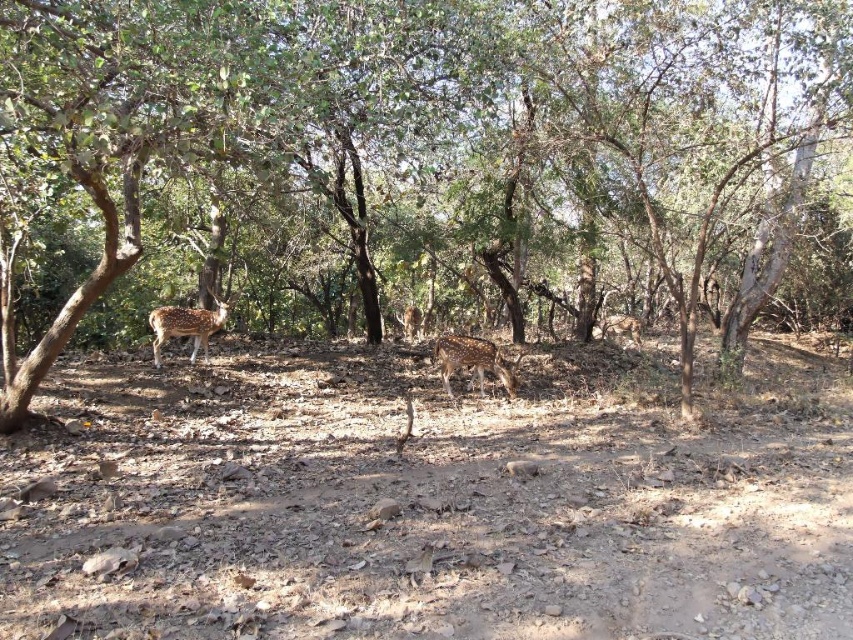
Question: Does brown dirt field at center have a smaller size compared to spotted fur deer at left?

Choices:
 (A) yes
 (B) no

Answer: (B)

Question: Which object appears closest to the camera in this image?

Choices:
 (A) spotted fur deer at center
 (B) spotted fur deer at left

Answer: (A)

Question: Observing the image, what is the correct spatial positioning of spotted fur deer at center in reference to spotted fur deer at left?

Choices:
 (A) left
 (B) right

Answer: (B)

Question: Is spotted fur deer at center below spotted fur deer at left?

Choices:
 (A) no
 (B) yes

Answer: (B)

Question: Which point appears farthest from the camera in this image?

Choices:
 (A) (177, 310)
 (B) (549, 269)

Answer: (B)

Question: Which of the following is the farthest from the observer?

Choices:
 (A) (292, 28)
 (B) (445, 420)
 (C) (457, 360)
 (D) (202, 336)

Answer: (D)